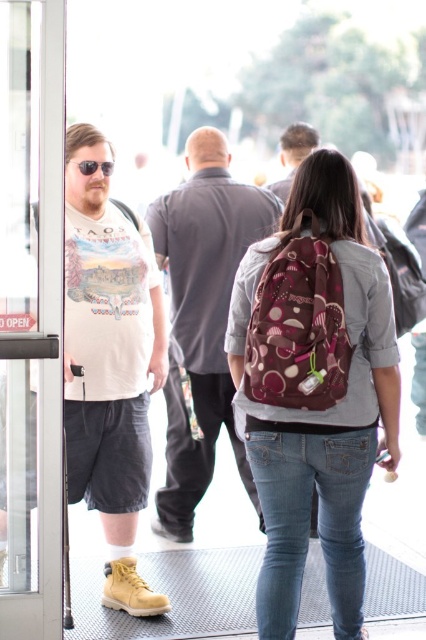
You are a delivery person trying to carry a large box through the entrance. The box is as wide as the matte gray shirt at center. Can you fit through the transparent glass door at left without tilting the box?

The transparent glass door at left is narrower than the matte gray shirt at center. Since the box is as wide as the matte gray shirt at center, it will not fit through the transparent glass door at left without tilting.

You are standing in front of the entrance and want to go inside. There is a transparent glass door at left and a matte gray shirt at center. Which object should you interact with to enter the building?

You should interact with the transparent glass door at left to enter the building since it is positioned to the left of the matte gray shirt at center, indicating it is the entrance.